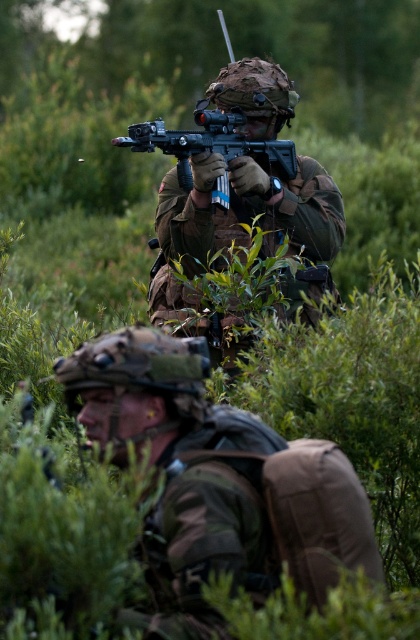
Question: Is camouflage fabric uniform at center to the left of matte black rifle at center from the viewer's perspective?

Choices:
 (A) no
 (B) yes

Answer: (A)

Question: Observing the image, what is the correct spatial positioning of camouflage fabric uniform at center in reference to matte black rifle at center?

Choices:
 (A) right
 (B) left

Answer: (A)

Question: Can you confirm if camouflage fabric uniform at center is bigger than matte black rifle at center?

Choices:
 (A) no
 (B) yes

Answer: (B)

Question: Which of the following is the closest to the observer?

Choices:
 (A) camouflage fabric uniform at center
 (B) matte black rifle at center

Answer: (B)